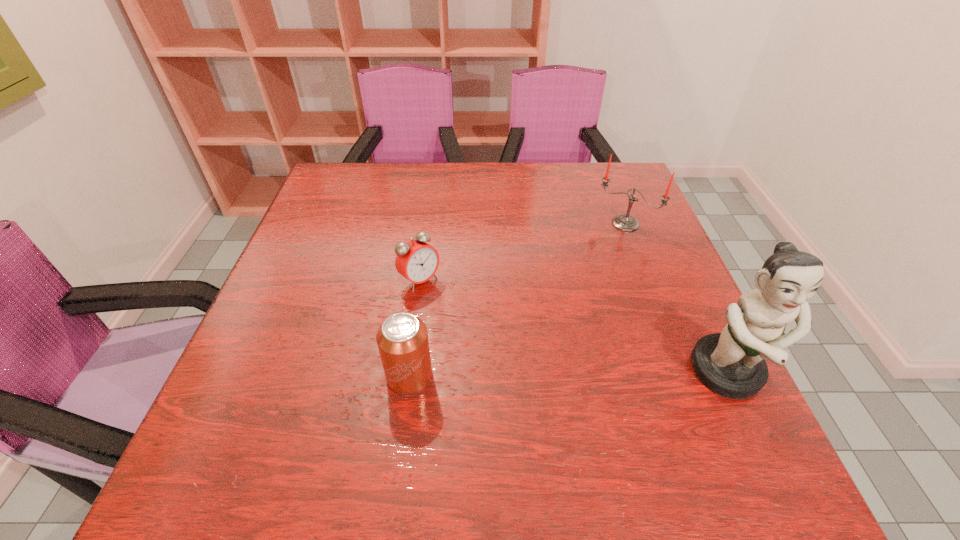
This screenshot has height=540, width=960. In order to click on free space at the left edge in this screenshot , I will do `click(259, 316)`.

Identify the location of free space at the right edge of the desktop. pos(703,325).

Where is `vacant space at the far left corner of the desktop`? This screenshot has width=960, height=540. vacant space at the far left corner of the desktop is located at coordinates 363,168.

Identify the location of free space between the tallest object and the can. The image size is (960, 540). (569, 375).

Find the location of `empty space between the shortest object and the farthest object`. empty space between the shortest object and the farthest object is located at coordinates point(522,252).

What are the coordinates of `empty space that is in between the farthest object and the shortest object` in the screenshot? It's located at (522, 252).

This screenshot has height=540, width=960. Identify the location of free space between the candle and the tallest object. (677, 299).

Locate an element on the screen. blank region between the can and the third shortest object is located at coordinates (517, 300).

Locate an element on the screen. The height and width of the screenshot is (540, 960). free space between the second tallest object and the figurine is located at coordinates (677, 299).

Image resolution: width=960 pixels, height=540 pixels. What are the coordinates of `vacant area that lies between the can and the tallest object` in the screenshot? It's located at (569, 375).